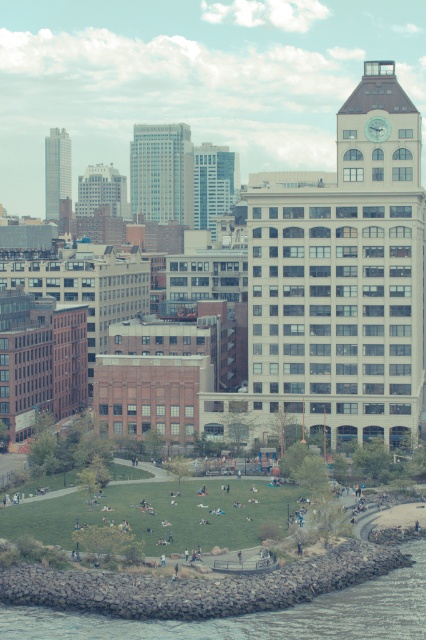
Based on the scene description, which object is positioned to the right of the other? The white glass building at center or the smooth glass skyscraper at upper left?

The white glass building at center is positioned to the right of the smooth glass skyscraper at upper left.

You are standing at the center of the park in the foreground. Looking towards the smooth glass skyscraper at center, in which direction should you walk to reach it?

Since the smooth glass skyscraper at center is located at point coordinates of 0.270 on the x axis and 0.380 on the y axis, you should walk towards the center of the image to reach it.

You are standing in the park and want to take a photo of both the gray rock wall at lower left and the smooth glass skyscraper at upper left. Which object should you frame first in your camera to ensure both are in the shot?

You should frame the gray rock wall at lower left first since it is closer to you than the smooth glass skyscraper at upper left, allowing both to be captured in the same shot.